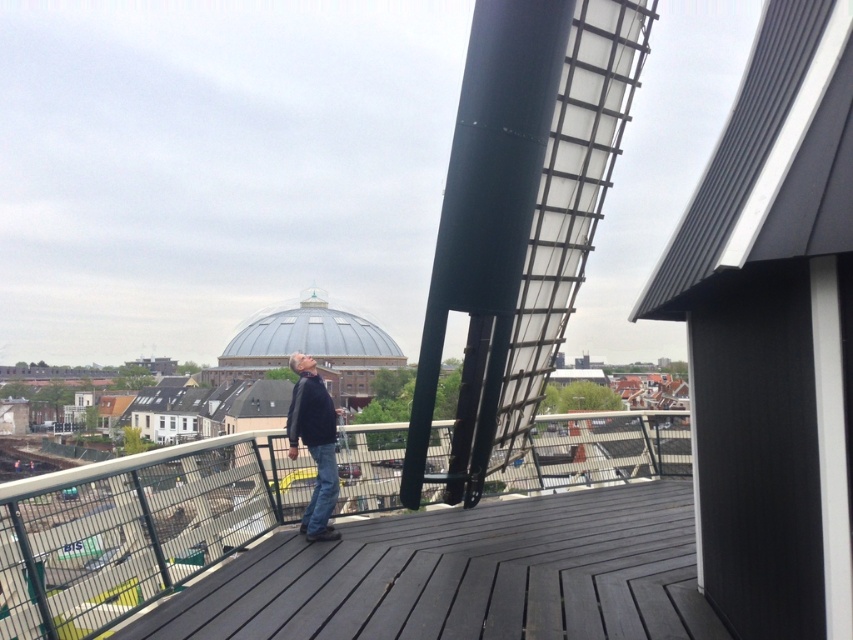
You are standing on the rooftop and want to move to the edge of the dark gray wood deck at center. What coordinates should you walk towards?

You should walk towards the coordinates point [465,577] to reach the edge of the dark gray wood deck at center.

You are standing on the wooden deck and want to take a photo of the city. There are two points marked in the scene. Which point is closer to you, point [689,536] or point [322,388]?

Point [689,536] is closer to you than point [322,388].

You are a delivery drone carrying a package that requires a landing zone of at least 10 feet in diameter. You are currently hovering above the dark gray wood deck at center and the dark blue jeans at center. Can you safely land here?

The distance between the dark gray wood deck at center and the dark blue jeans at center is 9.32 feet, which is less than the required 10 feet diameter. Therefore, the drone cannot safely land here.